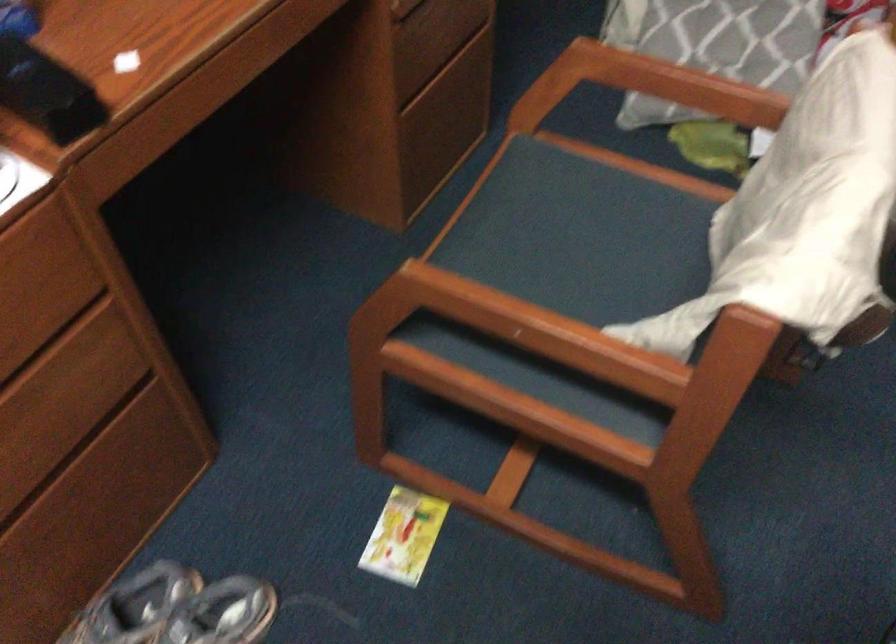
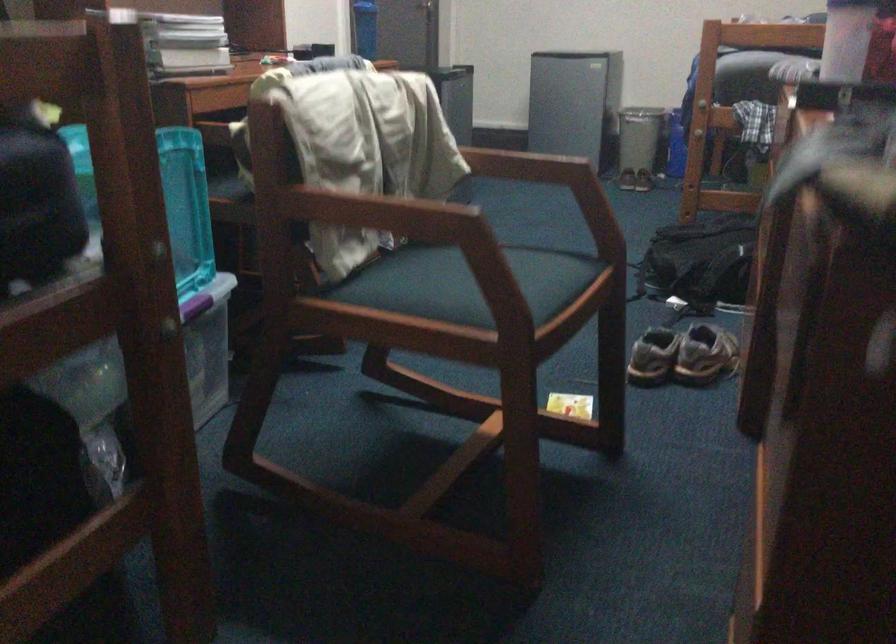
Locate, in the second image, the point that corresponds to (x=202, y=565) in the first image.

(682, 355)